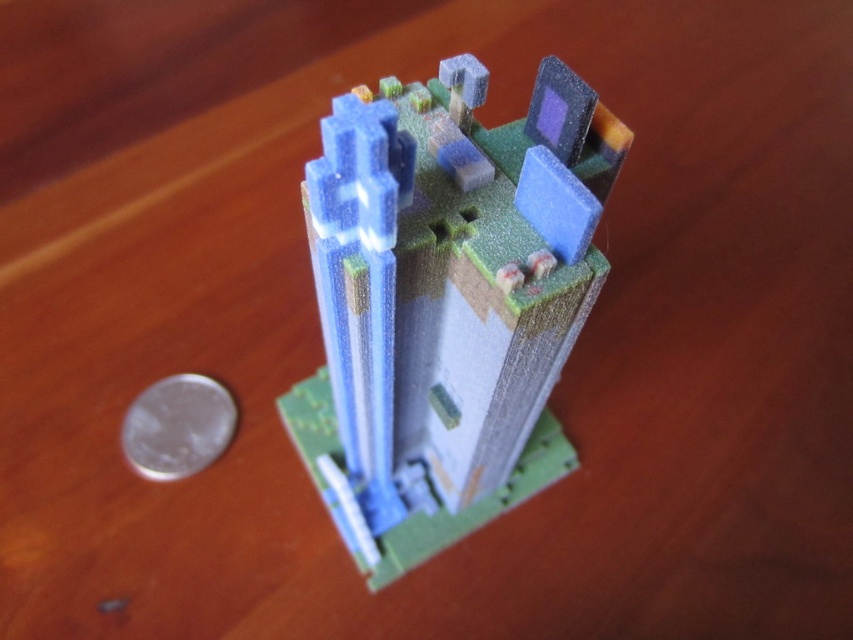
Based on the photo, can you confirm if translucent plastic building at center is positioned below silver metallic coin at lower left?

No, translucent plastic building at center is not below silver metallic coin at lower left.

Does point (346, 131) come closer to viewer compared to point (177, 400)?

Yes, it is in front of point (177, 400).

Find the location of a particular element. Image resolution: width=853 pixels, height=640 pixels. translucent plastic building at center is located at coordinates (445, 301).